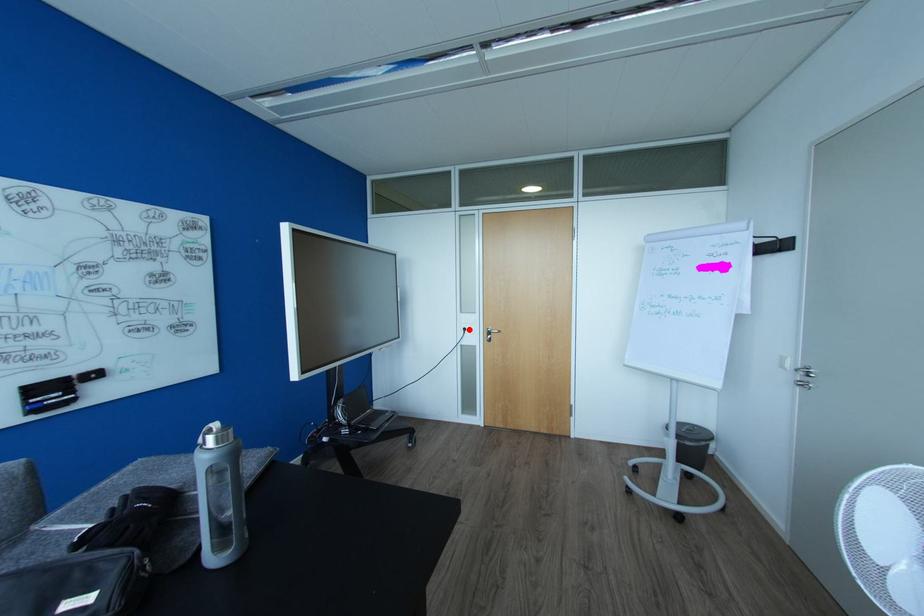
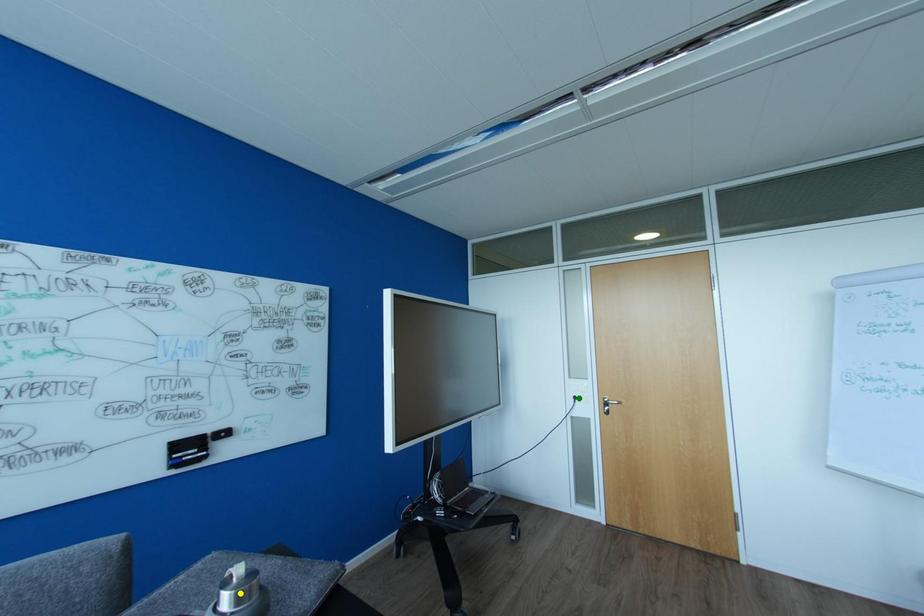
Question: I am providing you with two images of the same scene from different viewpoints. A red point is marked on the first image. You are given multiple points on the second image. In image 2, which mark is for the same physical point as the one in image 1?

Choices:
 (A) blue point
 (B) yellow point
 (C) green point

Answer: (C)